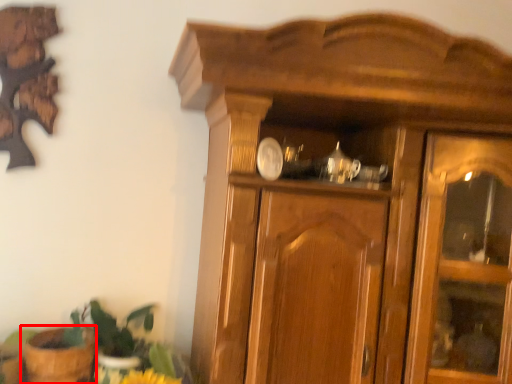
Question: In this image, where is flowerpot (annotated by the red box) located relative to houseplant?

Choices:
 (A) left
 (B) right

Answer: (A)